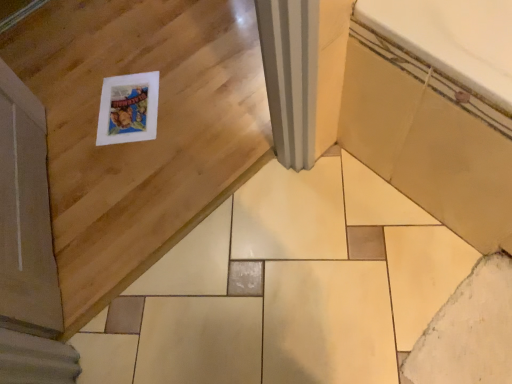
Identify the location of vacant space behind white matte ceramic tile at lower right. (407, 257).